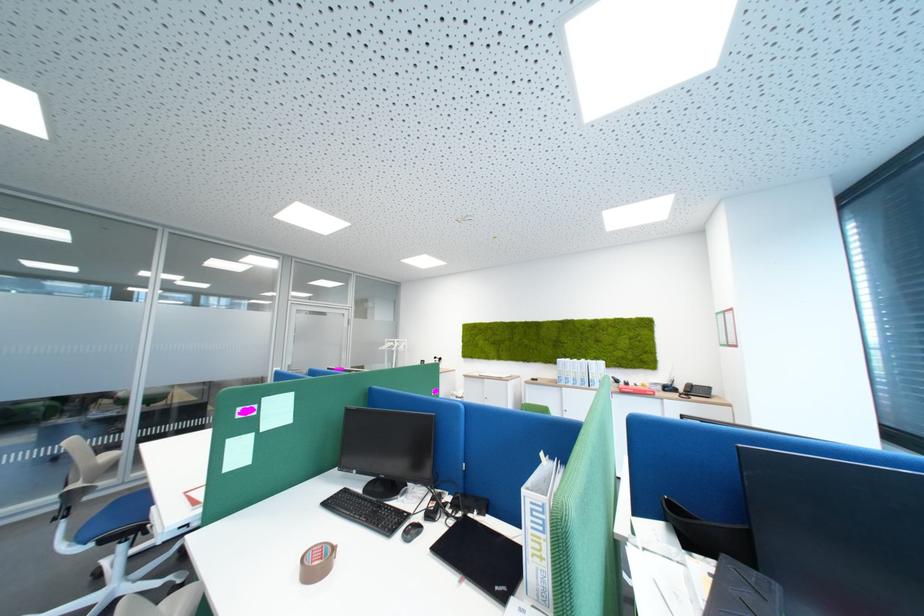
Find where to sit the blue chair sitting surface. Please return your answer as a coordinate pair (x, y).

(117, 602)